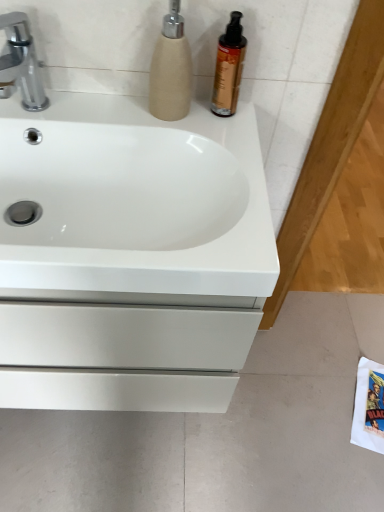
Where is `free area in between silver metallic faucet at upper left and shiny amber bottle at upper right`? free area in between silver metallic faucet at upper left and shiny amber bottle at upper right is located at coordinates (114, 111).